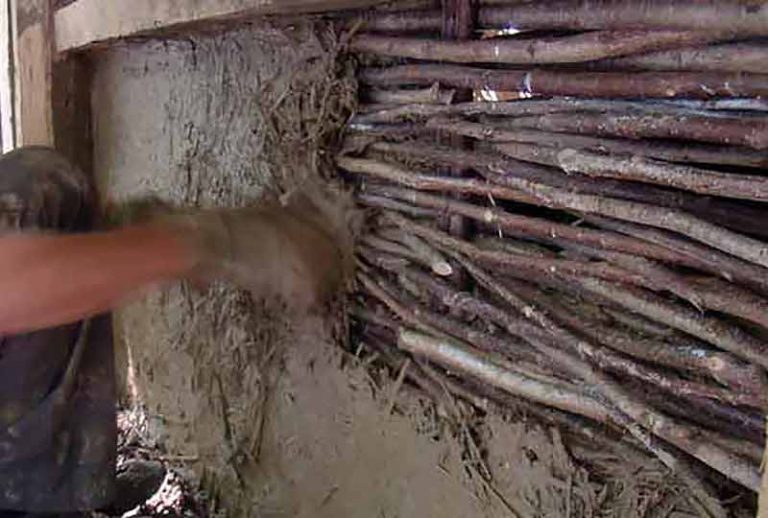
Where is `wooden door frame`? The height and width of the screenshot is (518, 768). wooden door frame is located at coordinates (55, 112).